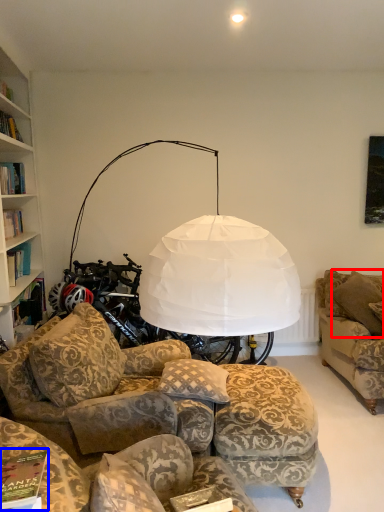
Question: Which point is further to the camera, pillow (highlighted by a red box) or magazine (highlighted by a blue box)?

Choices:
 (A) pillow
 (B) magazine

Answer: (A)